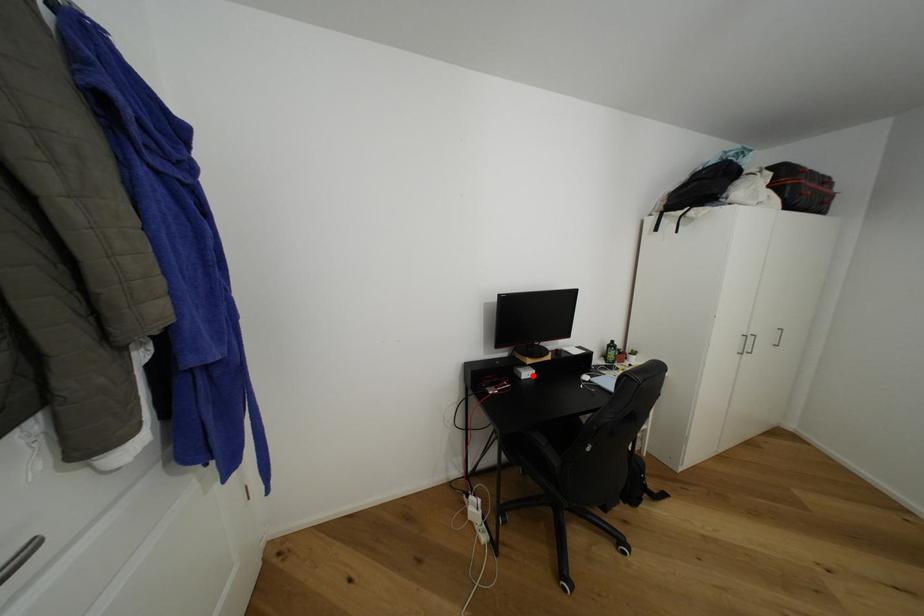
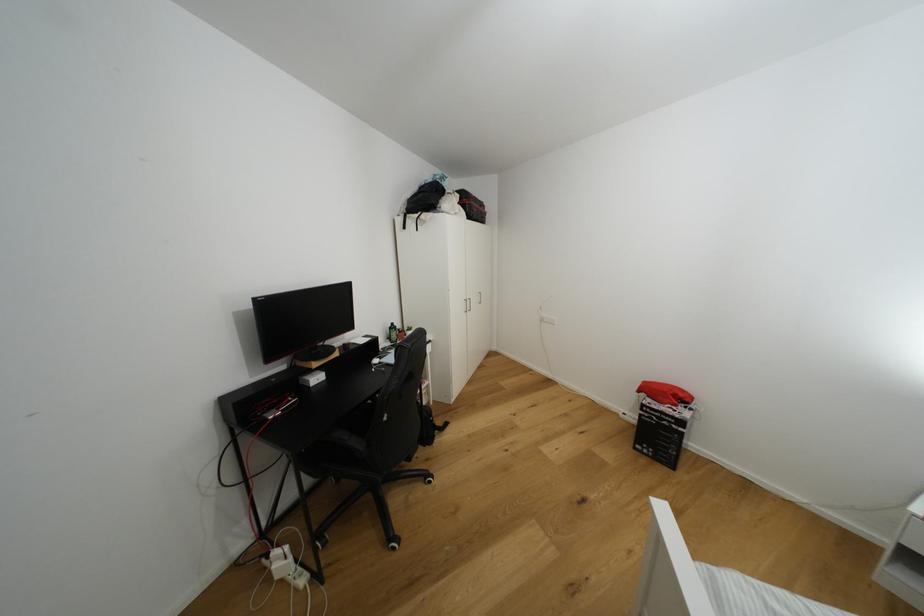
In the second image, find the point that corresponds to the highlighted location in the first image.

(322, 379)